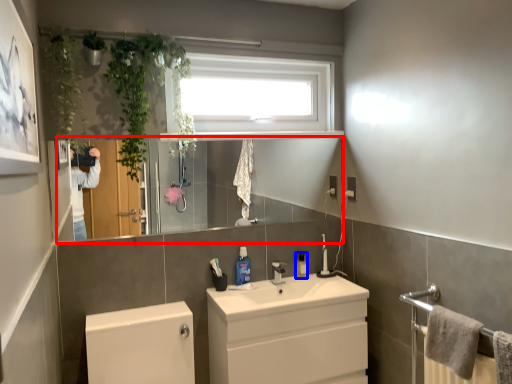
Question: Among these objects, which one is farthest to the camera, mirror (highlighted by a red box) or toiletry (highlighted by a blue box)?

Choices:
 (A) mirror
 (B) toiletry

Answer: (B)